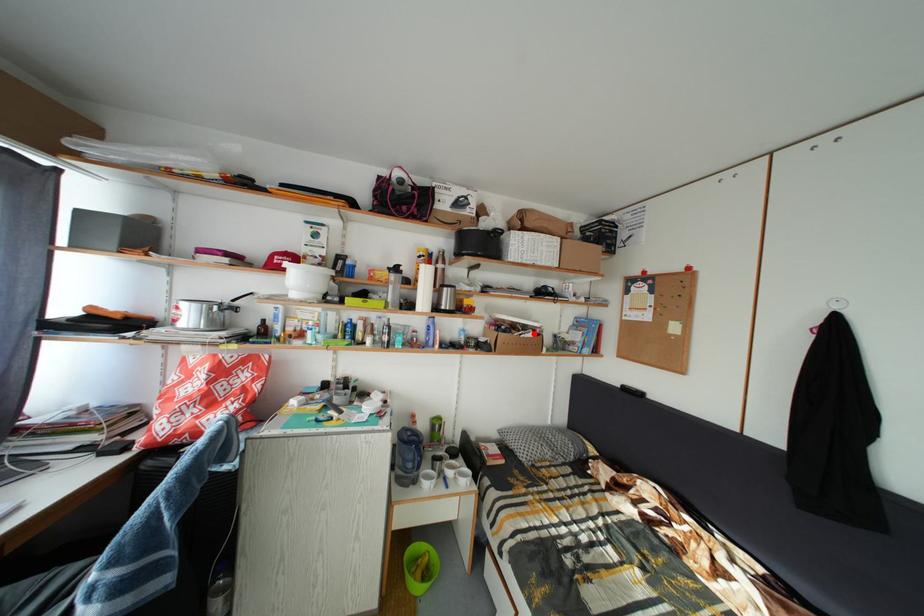
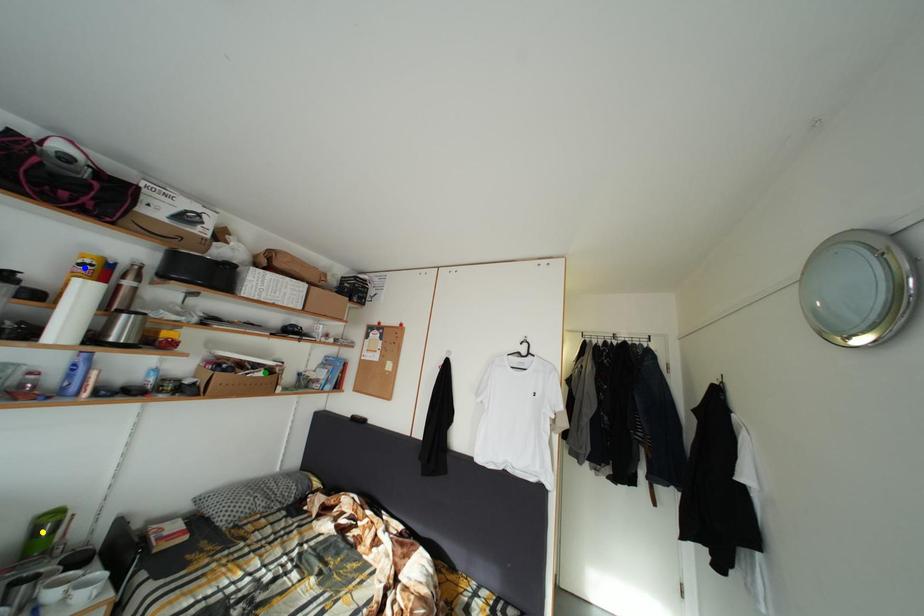
Question: I am providing you with two images of the same scene from different viewpoints. A red point is marked on the first image. You are given multiple points on the second image. Can you choose the point in image 2 that corresponds to the point in image 1?

Choices:
 (A) blue point
 (B) yellow point
 (C) green point

Answer: (C)